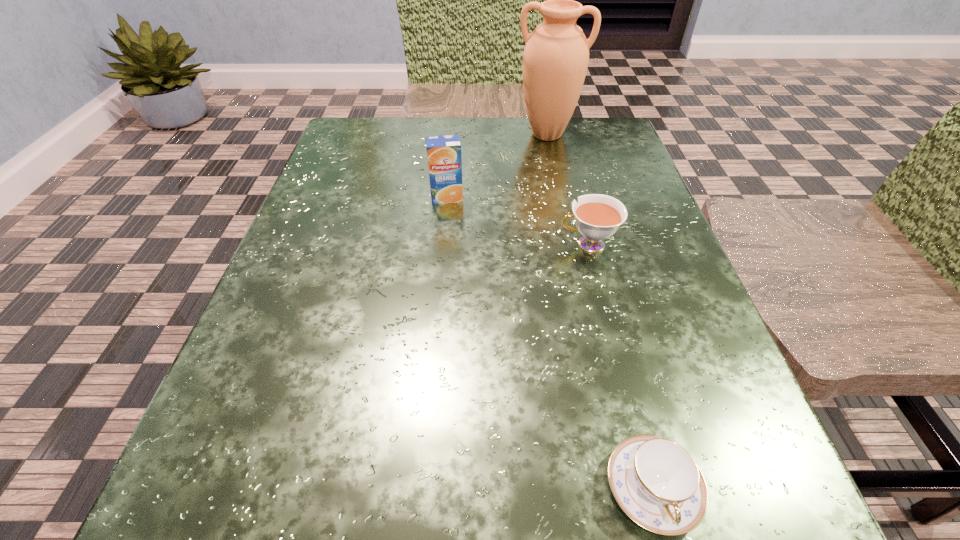
Identify the location of vacant space located on the side of the second nearest object with the handle. Image resolution: width=960 pixels, height=540 pixels. (342, 244).

Identify the location of object at the far edge. (556, 55).

Locate an element on the screen. urn at the right edge is located at coordinates (556, 55).

Find the location of a particular element. The image size is (960, 540). teacup located at the right edge is located at coordinates (597, 216).

Locate an element on the screen. This screenshot has height=540, width=960. object present at the far right corner is located at coordinates (556, 55).

This screenshot has width=960, height=540. I want to click on free region at the far edge, so click(518, 127).

In the image, there is a desktop. Where is `vacant space at the near edge`? The image size is (960, 540). vacant space at the near edge is located at coordinates (482, 522).

Find the location of `free space at the left edge`. free space at the left edge is located at coordinates (317, 180).

The height and width of the screenshot is (540, 960). What are the coordinates of `free point at the right edge` in the screenshot? It's located at click(609, 280).

The height and width of the screenshot is (540, 960). I want to click on vacant area at the far left corner of the desktop, so click(372, 117).